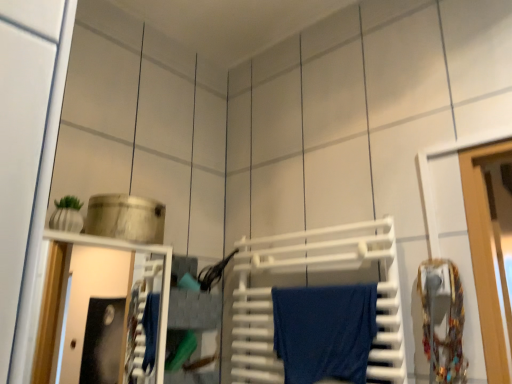
Question: In terms of height, does blue cotton towel at center look taller or shorter compared to white plastic towel rack at center?

Choices:
 (A) short
 (B) tall

Answer: (A)

Question: Considering the positions of blue cotton towel at center and white plastic towel rack at center in the image, is blue cotton towel at center wider or thinner than white plastic towel rack at center?

Choices:
 (A) thin
 (B) wide

Answer: (B)

Question: In the image, is blue cotton towel at center on the left side or the right side of white plastic towel rack at center?

Choices:
 (A) left
 (B) right

Answer: (B)

Question: In terms of height, does white plastic towel rack at center look taller or shorter compared to blue cotton towel at center?

Choices:
 (A) short
 (B) tall

Answer: (B)

Question: Visually, is white plastic towel rack at center positioned to the left or to the right of blue cotton towel at center?

Choices:
 (A) left
 (B) right

Answer: (A)

Question: Does point (401, 375) appear closer or farther from the camera than point (314, 360)?

Choices:
 (A) closer
 (B) farther

Answer: (A)

Question: Considering their positions, is white plastic towel rack at center located in front of or behind blue cotton towel at center?

Choices:
 (A) front
 (B) behind

Answer: (A)